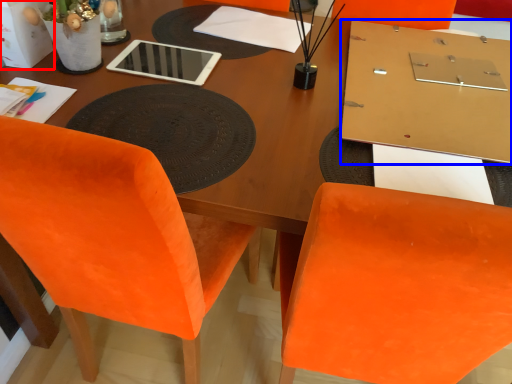
Question: Which object appears farthest to the camera in this image, box (highlighted by a red box) or table (highlighted by a blue box)?

Choices:
 (A) box
 (B) table

Answer: (A)